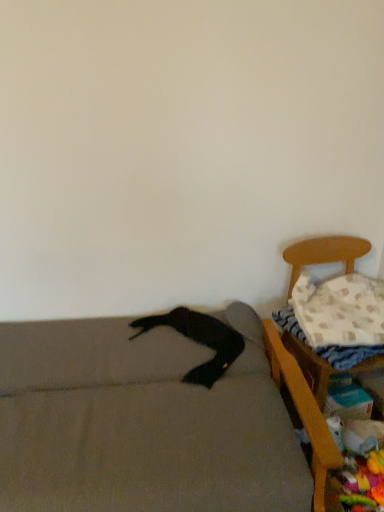
Question: Considering the relative positions of wooden chair at right, which is the 1th furniture in right-to-left order, and soft gray couch at lower left, which appears as the first furniture when viewed from the left, in the image provided, is wooden chair at right, which is the 1th furniture in right-to-left order, to the left of soft gray couch at lower left, which appears as the first furniture when viewed from the left, from the viewer's perspective?

Choices:
 (A) yes
 (B) no

Answer: (B)

Question: Is wooden chair at right, which is the 1th furniture in right-to-left order, aimed at soft gray couch at lower left, arranged as the 2th furniture when viewed from the right?

Choices:
 (A) yes
 (B) no

Answer: (B)

Question: Is wooden chair at right, which is the 1th furniture in right-to-left order, wider than soft gray couch at lower left, which appears as the first furniture when viewed from the left?

Choices:
 (A) yes
 (B) no

Answer: (B)

Question: Can you confirm if wooden chair at right, which is counted as the second furniture, starting from the left, is smaller than soft gray couch at lower left, arranged as the 2th furniture when viewed from the right?

Choices:
 (A) no
 (B) yes

Answer: (B)

Question: From the image's perspective, is wooden chair at right, which is counted as the second furniture, starting from the left, beneath soft gray couch at lower left, arranged as the 2th furniture when viewed from the right?

Choices:
 (A) yes
 (B) no

Answer: (B)

Question: From a real-world perspective, is wooden chair at right, which is the 1th furniture in right-to-left order, over soft gray couch at lower left, arranged as the 2th furniture when viewed from the right?

Choices:
 (A) no
 (B) yes

Answer: (B)

Question: Can you confirm if white textured blanket at right is taller than white textured pillow at right?

Choices:
 (A) yes
 (B) no

Answer: (B)

Question: Is white textured blanket at right aimed at white textured pillow at right?

Choices:
 (A) yes
 (B) no

Answer: (A)

Question: Does white textured blanket at right have a lesser width compared to white textured pillow at right?

Choices:
 (A) yes
 (B) no

Answer: (B)

Question: Is white textured blanket at right to the right of white textured pillow at right from the viewer's perspective?

Choices:
 (A) yes
 (B) no

Answer: (B)

Question: Would you say white textured pillow at right is part of white textured blanket at right's contents?

Choices:
 (A) no
 (B) yes

Answer: (A)

Question: Is white textured blanket at right touching white textured pillow at right?

Choices:
 (A) no
 (B) yes

Answer: (A)

Question: Is white textured blanket at right smaller than soft gray couch at lower left, which appears as the first furniture when viewed from the left?

Choices:
 (A) yes
 (B) no

Answer: (A)